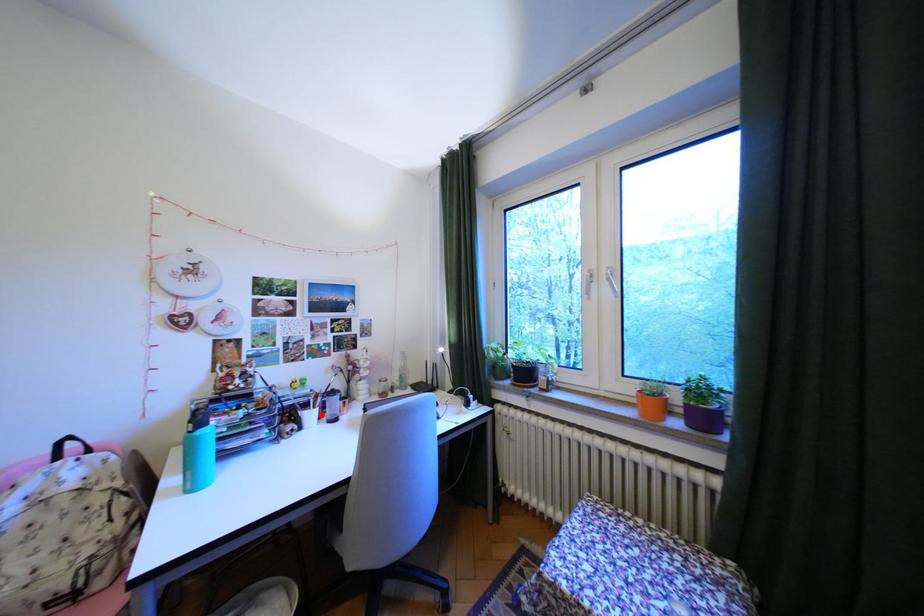
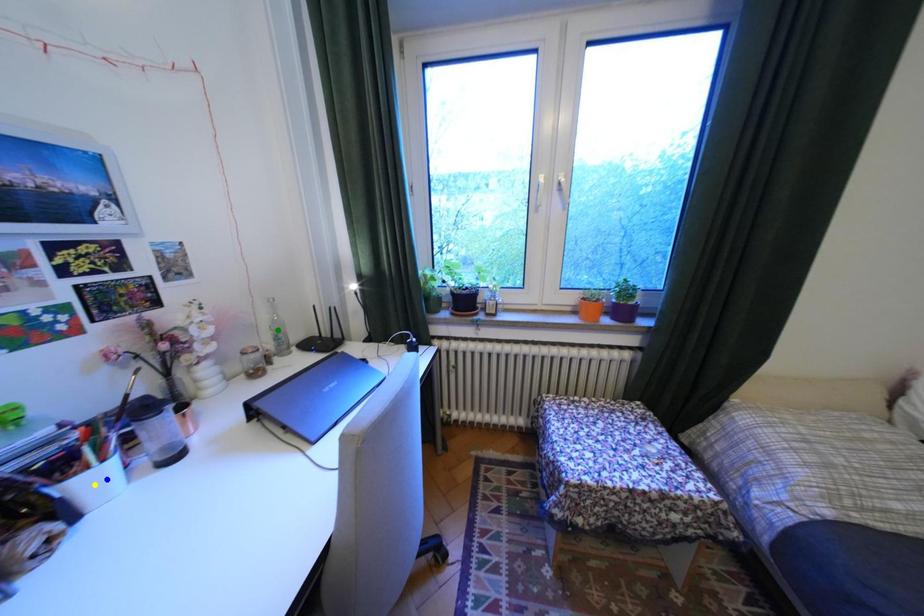
Question: I am providing you with two images of the same scene from different viewpoints. A red point is marked on the first image. You are given multiple points on the second image. In image 2, which mark is for the same physical point as the one in image 1?

Choices:
 (A) green point
 (B) blue point
 (C) yellow point

Answer: (B)